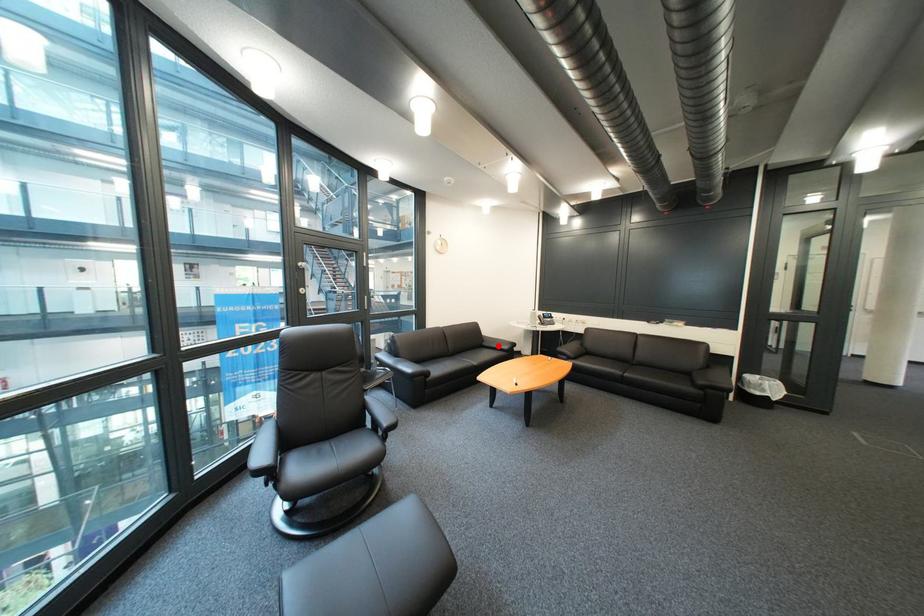
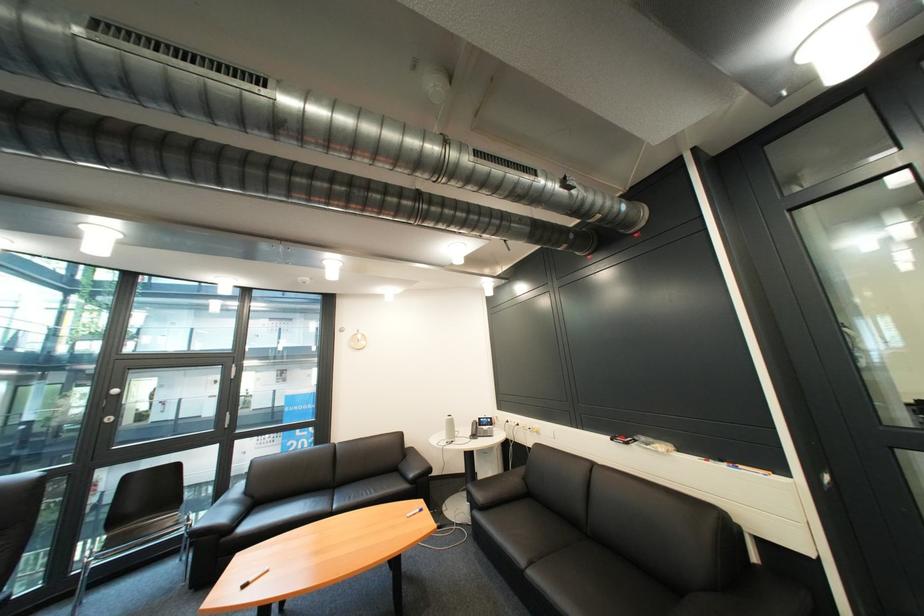
Find the pixel in the second image that matches the highlighted location in the first image.

(414, 468)